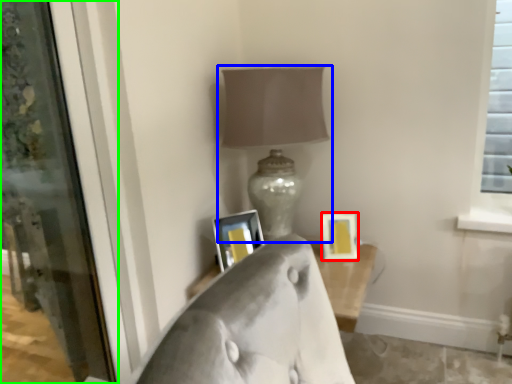
Question: Based on their relative distances, which object is farther from picture frame (highlighted by a red box)? Choose from lamp (highlighted by a blue box) and screen door (highlighted by a green box).

Choices:
 (A) lamp
 (B) screen door

Answer: (B)